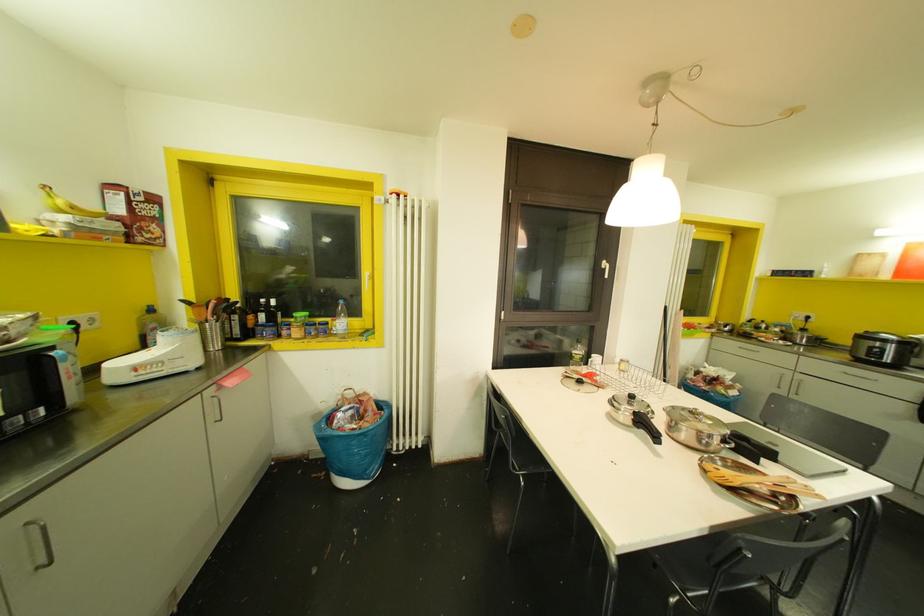
What do you see at coordinates (156, 358) in the screenshot? The height and width of the screenshot is (616, 924). I see `the white food processor` at bounding box center [156, 358].